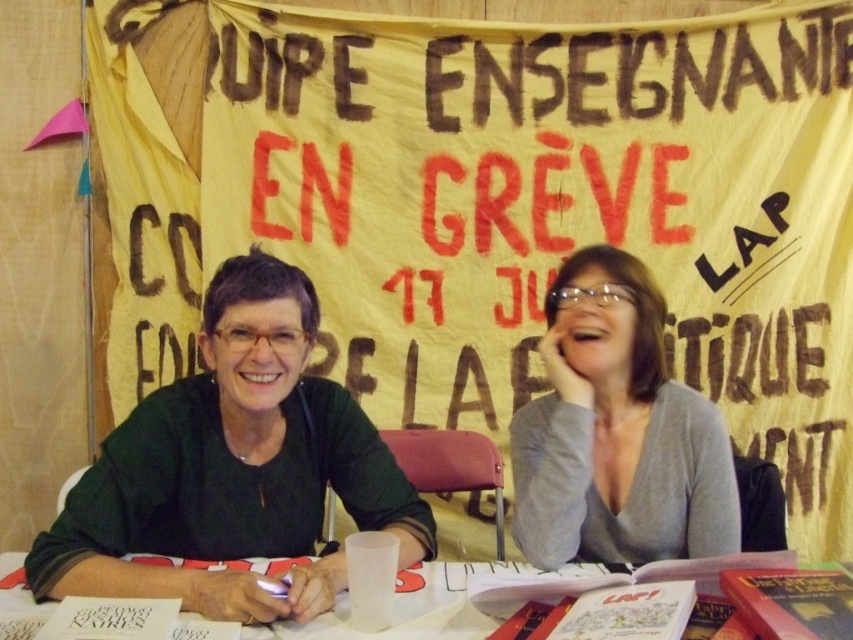
Does green matte shirt at center have a greater height compared to white plastic table at center?

Indeed, green matte shirt at center has a greater height compared to white plastic table at center.

Between green matte shirt at center and white plastic table at center, which one is positioned higher?

green matte shirt at center is higher up.

The image size is (853, 640). Find the location of `green matte shirt at center`. green matte shirt at center is located at coordinates (231, 468).

Can you confirm if gray matte sweater at center is bigger than white plastic table at center?

Yes, gray matte sweater at center is bigger than white plastic table at center.

Who is more distant from viewer, (515,413) or (3,580)?

The point (515,413) is more distant.

Which is in front, point (544, 401) or point (305, 636)?

Point (305, 636) is in front.

Image resolution: width=853 pixels, height=640 pixels. I want to click on gray matte sweater at center, so click(x=616, y=432).

Can you confirm if green matte shirt at center is thinner than gray matte sweater at center?

In fact, green matte shirt at center might be wider than gray matte sweater at center.

Which is above, green matte shirt at center or gray matte sweater at center?

gray matte sweater at center

Where is `green matte shirt at center`? Image resolution: width=853 pixels, height=640 pixels. green matte shirt at center is located at coordinates (231, 468).